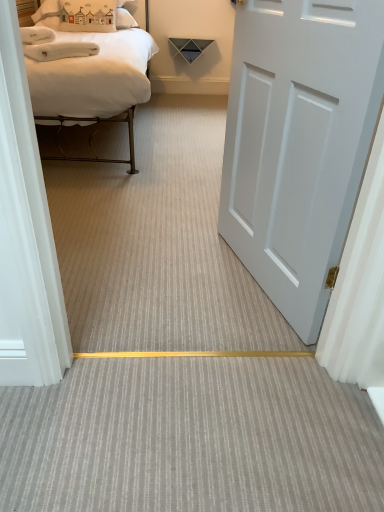
Question: Does white fabric pillow at upper left come behind white matte bed at upper left?

Choices:
 (A) yes
 (B) no

Answer: (A)

Question: Is white fabric pillow at upper left completely or partially outside of white matte bed at upper left?

Choices:
 (A) yes
 (B) no

Answer: (B)

Question: Does white fabric pillow at upper left have a larger size compared to white matte bed at upper left?

Choices:
 (A) yes
 (B) no

Answer: (B)

Question: Does white fabric pillow at upper left appear on the left side of white matte bed at upper left?

Choices:
 (A) no
 (B) yes

Answer: (B)

Question: Is white fabric pillow at upper left turned away from white matte bed at upper left?

Choices:
 (A) no
 (B) yes

Answer: (B)

Question: Does white fabric pillow at upper left turn towards white matte bed at upper left?

Choices:
 (A) yes
 (B) no

Answer: (A)

Question: Is white matte bed at upper left at the right side of white matte door at right?

Choices:
 (A) no
 (B) yes

Answer: (A)

Question: Considering the relative sizes of white matte bed at upper left and white matte door at right in the image provided, is white matte bed at upper left wider than white matte door at right?

Choices:
 (A) no
 (B) yes

Answer: (B)

Question: Considering the relative sizes of white matte bed at upper left and white matte door at right in the image provided, is white matte bed at upper left taller than white matte door at right?

Choices:
 (A) yes
 (B) no

Answer: (B)

Question: Is white matte bed at upper left bigger than white matte door at right?

Choices:
 (A) no
 (B) yes

Answer: (B)

Question: Is white matte door at right inside white matte bed at upper left?

Choices:
 (A) yes
 (B) no

Answer: (B)

Question: Is white matte bed at upper left facing towards white matte door at right?

Choices:
 (A) yes
 (B) no

Answer: (A)

Question: From the image's perspective, is gray textured carpet at center above white matte door at right?

Choices:
 (A) no
 (B) yes

Answer: (A)